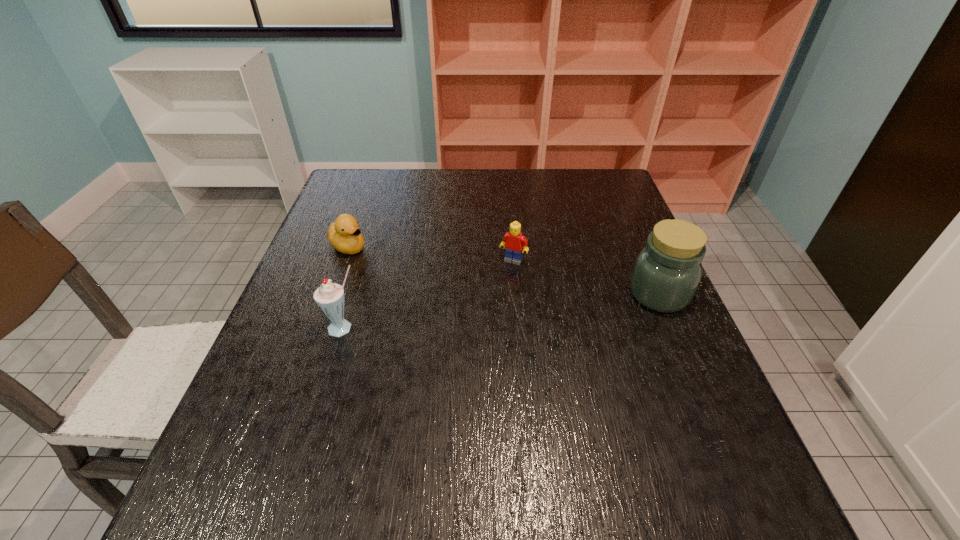
The image size is (960, 540). In order to click on the nearest object in this screenshot , I will do `click(329, 297)`.

This screenshot has width=960, height=540. What are the coordinates of `jar` in the screenshot? It's located at (667, 271).

Where is `the third farthest object`? The width and height of the screenshot is (960, 540). the third farthest object is located at coordinates (667, 271).

Image resolution: width=960 pixels, height=540 pixels. In order to click on duckling in this screenshot , I will do `click(344, 234)`.

You are a GUI agent. You are given a task and a screenshot of the screen. Output one action in this format:
    pyautogui.click(x=<x>, y=<y>)
    Task: Click on the third object from left to right
    This screenshot has width=960, height=540.
    Given the screenshot: What is the action you would take?
    pyautogui.click(x=513, y=242)

Locate an element on the screen. The width and height of the screenshot is (960, 540). vacant area located on the straw side of the nearest object is located at coordinates (328, 382).

This screenshot has height=540, width=960. Identify the location of free space located 0.140m on the left of the second nearest object. (570, 294).

Find the location of a particular element. vacant space located 0.080m on the face of the duckling is located at coordinates (382, 266).

Where is `vacant position located on the face of the duckling`? This screenshot has width=960, height=540. vacant position located on the face of the duckling is located at coordinates (468, 319).

The height and width of the screenshot is (540, 960). Find the location of `vacant space situated 0.150m on the face of the duckling`. vacant space situated 0.150m on the face of the duckling is located at coordinates (400, 278).